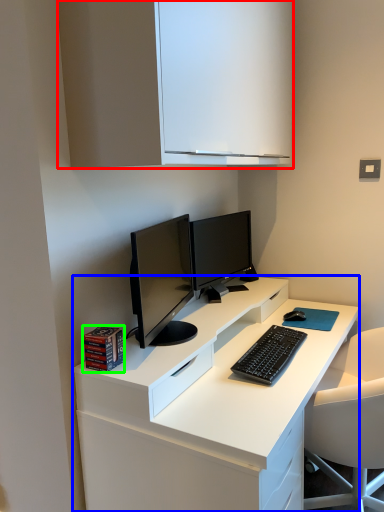
Question: Based on their relative distances, which object is nearer to cabinetry (highlighted by a red box)? Choose from desk (highlighted by a blue box) and book (highlighted by a green box).

Choices:
 (A) desk
 (B) book

Answer: (B)